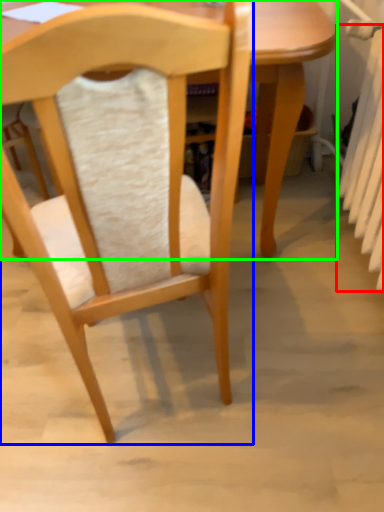
Question: Considering the real-world distances, which object is farthest from radiator (highlighted by a red box)? chair (highlighted by a blue box) or table (highlighted by a green box)?

Choices:
 (A) chair
 (B) table

Answer: (A)